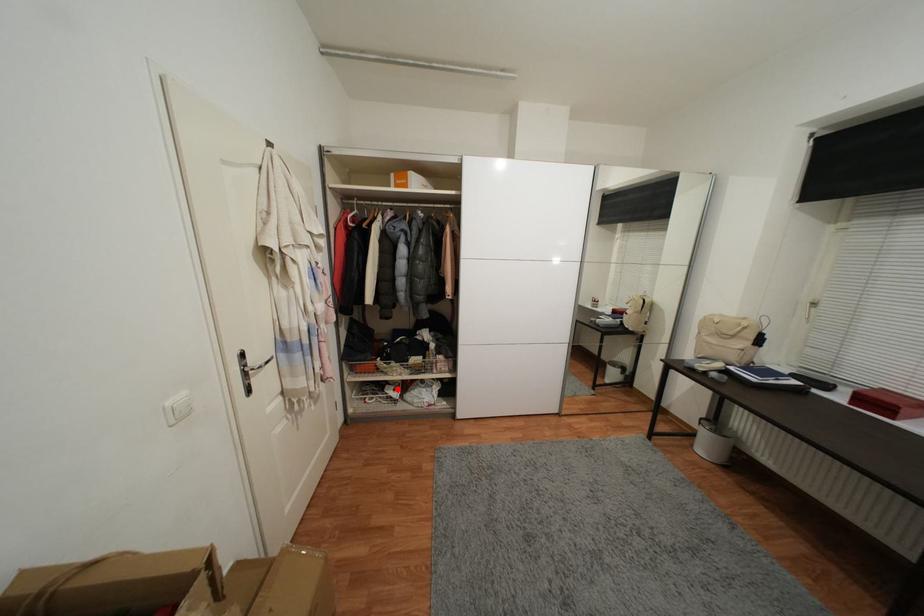
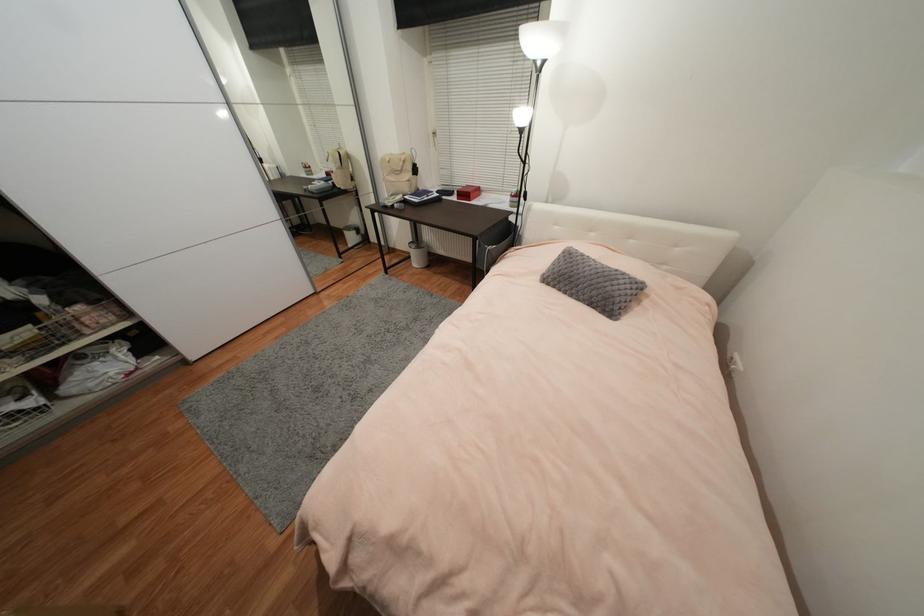
Question: I am providing you with two images of the same scene from different viewpoints. Given a red point in image1, look at the same physical point in image2. Is it:

Choices:
 (A) Closer to the viewpoint
 (B) Farther from the viewpoint

Answer: (B)